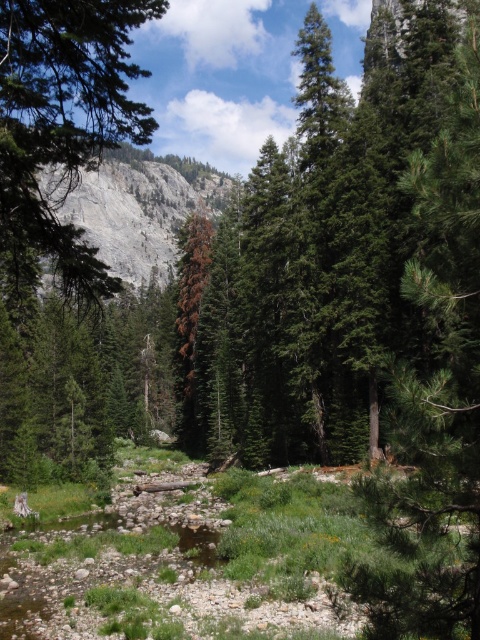
Question: Is green textured pine tree at right above green textured tree at center?

Choices:
 (A) no
 (B) yes

Answer: (A)

Question: Observing the image, what is the correct spatial positioning of green textured pine tree at right in reference to green textured tree at center?

Choices:
 (A) left
 (B) right

Answer: (B)

Question: Which object is the farthest from the green textured pine tree at right?

Choices:
 (A) green textured tree at center
 (B) gray rock formation at upper left

Answer: (B)

Question: Among these points, which one is farthest from the camera?

Choices:
 (A) tap(226, 182)
 (B) tap(439, 138)
 (C) tap(2, 112)

Answer: (A)

Question: Is the position of green textured pine tree at right more distant than that of gray rock formation at upper left?

Choices:
 (A) yes
 (B) no

Answer: (B)

Question: Which is farther from the green textured pine tree at right?

Choices:
 (A) gray rock formation at upper left
 (B) green textured tree at center

Answer: (A)